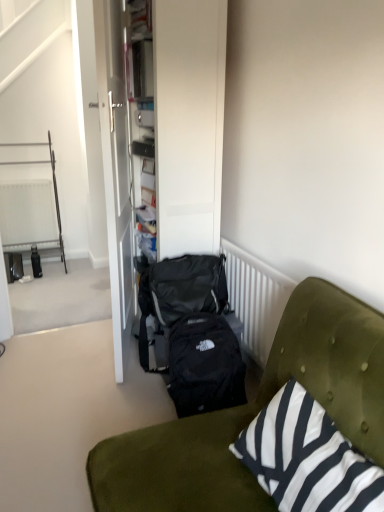
Question: From the image's perspective, is matte black bottle at left beneath matte black suitcase at center?

Choices:
 (A) yes
 (B) no

Answer: (A)

Question: Is matte black bottle at left outside of matte black suitcase at center?

Choices:
 (A) no
 (B) yes

Answer: (B)

Question: From a real-world perspective, is matte black bottle at left positioned under matte black suitcase at center based on gravity?

Choices:
 (A) no
 (B) yes

Answer: (B)

Question: From a real-world perspective, is matte black bottle at left located higher than matte black suitcase at center?

Choices:
 (A) yes
 (B) no

Answer: (B)

Question: Can you confirm if matte black bottle at left is thinner than matte black suitcase at center?

Choices:
 (A) yes
 (B) no

Answer: (A)

Question: Does matte black bottle at left touch matte black suitcase at center?

Choices:
 (A) no
 (B) yes

Answer: (A)

Question: Would you consider matte black suitcase at center to be distant from white glossy door at center?

Choices:
 (A) no
 (B) yes

Answer: (A)

Question: Is matte black suitcase at center to the left of white glossy door at center from the viewer's perspective?

Choices:
 (A) yes
 (B) no

Answer: (B)

Question: Considering the relative sizes of matte black suitcase at center and white glossy door at center in the image provided, is matte black suitcase at center smaller than white glossy door at center?

Choices:
 (A) yes
 (B) no

Answer: (B)

Question: Does matte black suitcase at center turn towards white glossy door at center?

Choices:
 (A) yes
 (B) no

Answer: (A)

Question: Is matte black suitcase at center oriented away from white glossy door at center?

Choices:
 (A) yes
 (B) no

Answer: (A)

Question: From the image's perspective, is matte black suitcase at center on white glossy door at center?

Choices:
 (A) yes
 (B) no

Answer: (A)

Question: Is velvet green couch at lower right positioned in front of white glossy door at center?

Choices:
 (A) yes
 (B) no

Answer: (A)